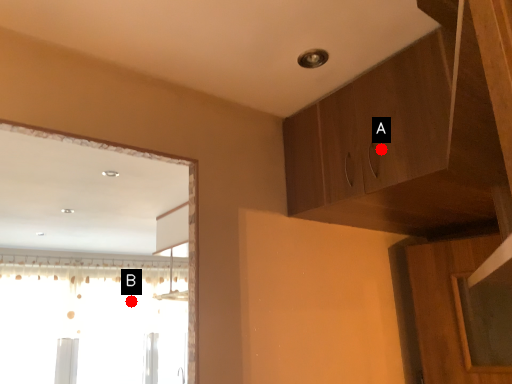
Question: Two points are circled on the image, labeled by A and B beside each circle. Which point is closer to the camera taking this photo?

Choices:
 (A) A is closer
 (B) B is closer

Answer: (A)